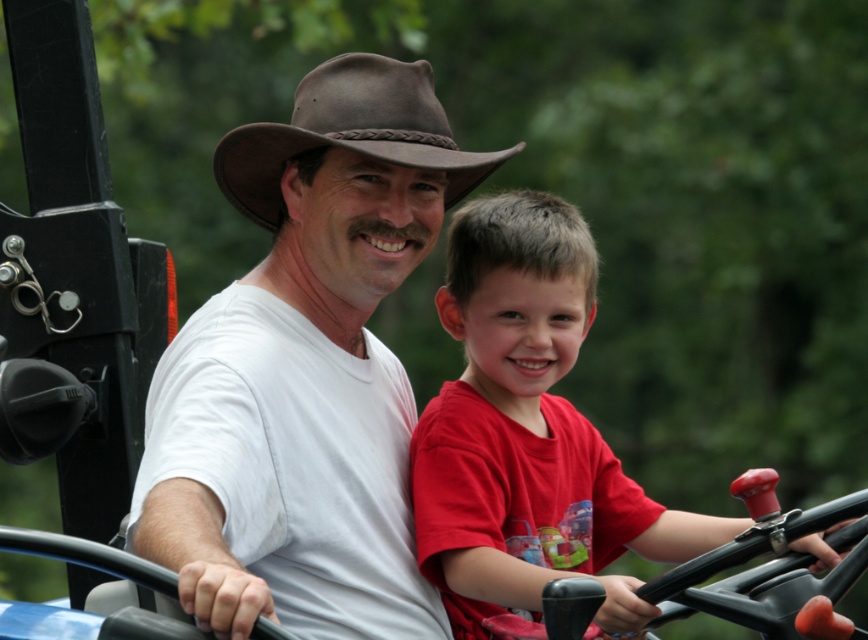
Question: Which is nearer to the brown leather fedora at center?

Choices:
 (A) red matte shirt at center
 (B) white matte shirt at center

Answer: (B)

Question: Estimate the real-world distances between objects in this image. Which object is farther from the red matte shirt at center?

Choices:
 (A) brown leather fedora at center
 (B) white matte shirt at center

Answer: (A)

Question: Can you confirm if red matte shirt at center is positioned to the left of brown leather fedora at center?

Choices:
 (A) yes
 (B) no

Answer: (B)

Question: Does white matte shirt at center have a lesser width compared to red matte shirt at center?

Choices:
 (A) no
 (B) yes

Answer: (A)

Question: Is red matte shirt at center bigger than brown leather fedora at center?

Choices:
 (A) no
 (B) yes

Answer: (B)

Question: Which point is farther to the camera?

Choices:
 (A) white matte shirt at center
 (B) brown leather fedora at center
 (C) red matte shirt at center

Answer: (B)